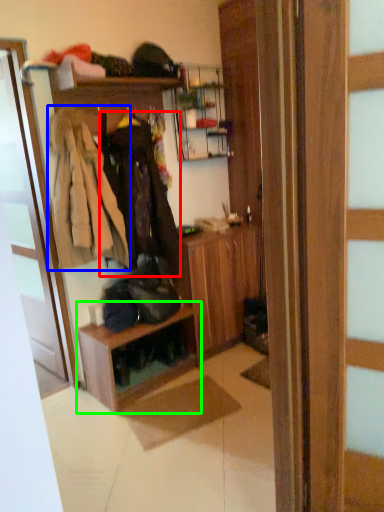
Question: Which object is positioned farthest from clothing (highlighted by a red box)? Select from clothing (highlighted by a blue box) and shelf (highlighted by a green box).

Choices:
 (A) clothing
 (B) shelf

Answer: (B)